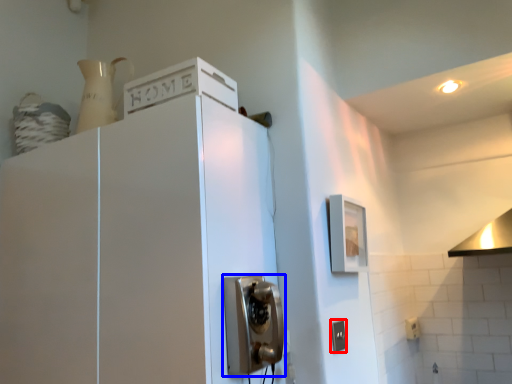
Question: Which of the following is the farthest to the observer, electric outlet (highlighted by a red box) or door handle (highlighted by a blue box)?

Choices:
 (A) electric outlet
 (B) door handle

Answer: (A)